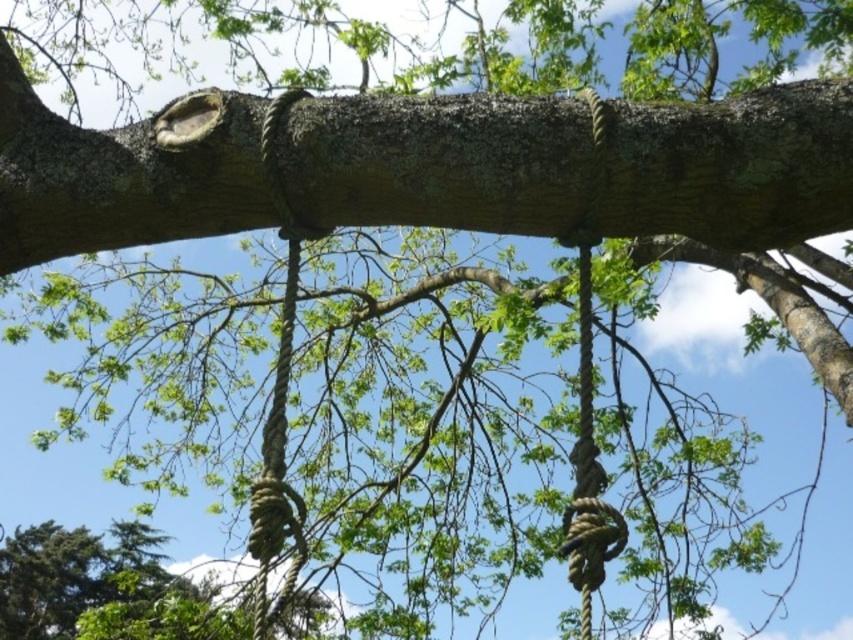
Who is positioned more to the right, rope at center or rope at upper center?

Positioned to the right is rope at upper center.

Can you confirm if rope at center is smaller than rope at upper center?

No.

Who is more distant from viewer, (299, 93) or (589, 545)?

The point (299, 93) is behind.

What are the coordinates of `rope at center` in the screenshot? It's located at (277, 401).

Based on the photo, which is more to the left, rough bark tree trunk at center or rope at center?

Positioned to the left is rope at center.

Who is more distant from viewer, (28, 128) or (273, 384)?

The point (273, 384) is behind.

You are a GUI agent. You are given a task and a screenshot of the screen. Output one action in this format:
    pyautogui.click(x=<x>, y=<y>)
    Task: Click on the rough bark tree trunk at center
    The height and width of the screenshot is (640, 853).
    Given the screenshot: What is the action you would take?
    pos(439,163)

Between rough bark tree trunk at center and rope at upper center, which one has less height?

Standing shorter between the two is rough bark tree trunk at center.

Does rough bark tree trunk at center appear over rope at upper center?

Yes, rough bark tree trunk at center is above rope at upper center.

Is point (250, 138) farther from viewer compared to point (596, 131)?

That is True.

Find the location of a particular element. The height and width of the screenshot is (640, 853). rough bark tree trunk at center is located at coordinates (439, 163).